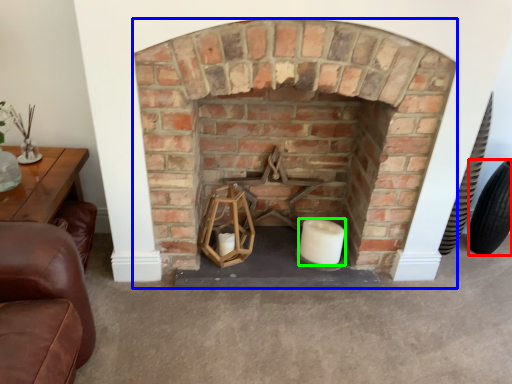
Question: Which object is positioned farthest from tire (highlighted by a red box)? Select from fireplace (highlighted by a blue box) and candle (highlighted by a green box).

Choices:
 (A) fireplace
 (B) candle

Answer: (A)